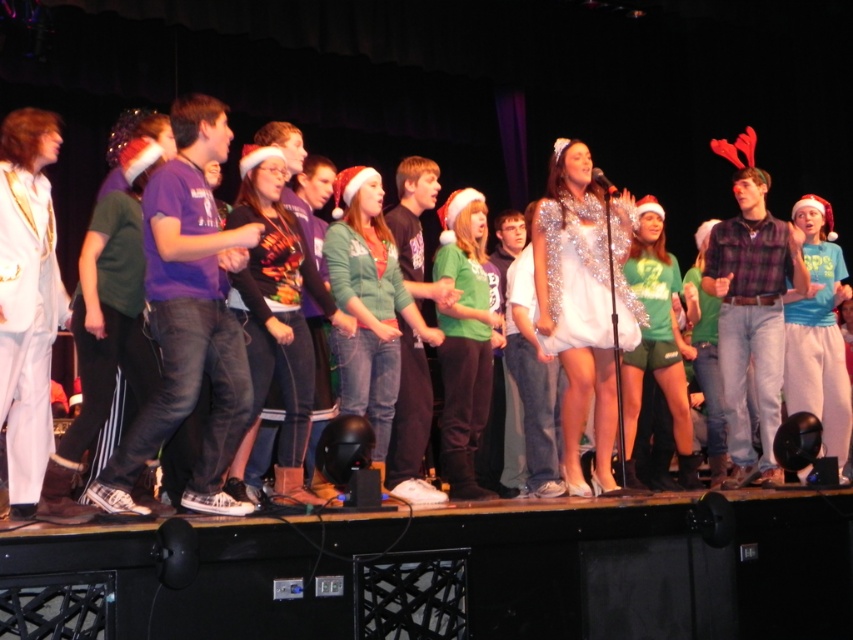
What do you see at coordinates (709, 179) in the screenshot? I see `shiny silver dress at center` at bounding box center [709, 179].

The width and height of the screenshot is (853, 640). I want to click on shiny silver dress at center, so click(x=709, y=179).